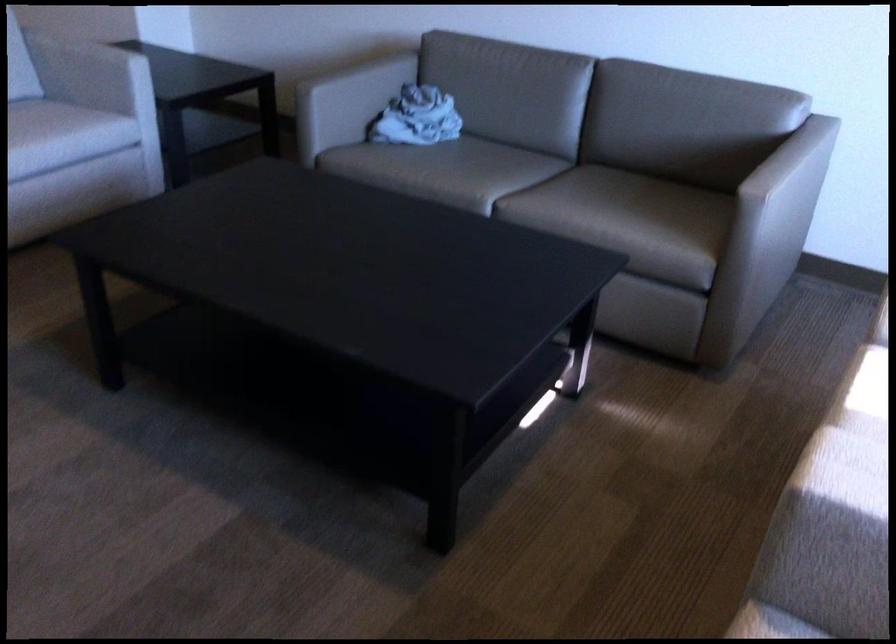
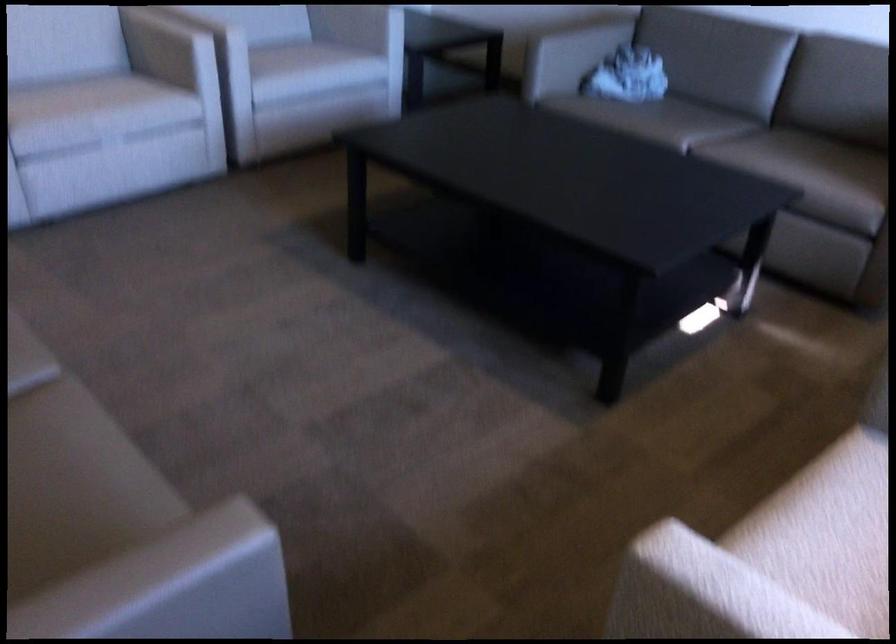
Question: Which direction would the cameraman need to move to produce the second image? Reply with the corresponding letter.

Choices:
 (A) Left
 (B) Right
 (C) Forward
 (D) Backward

Answer: (D)